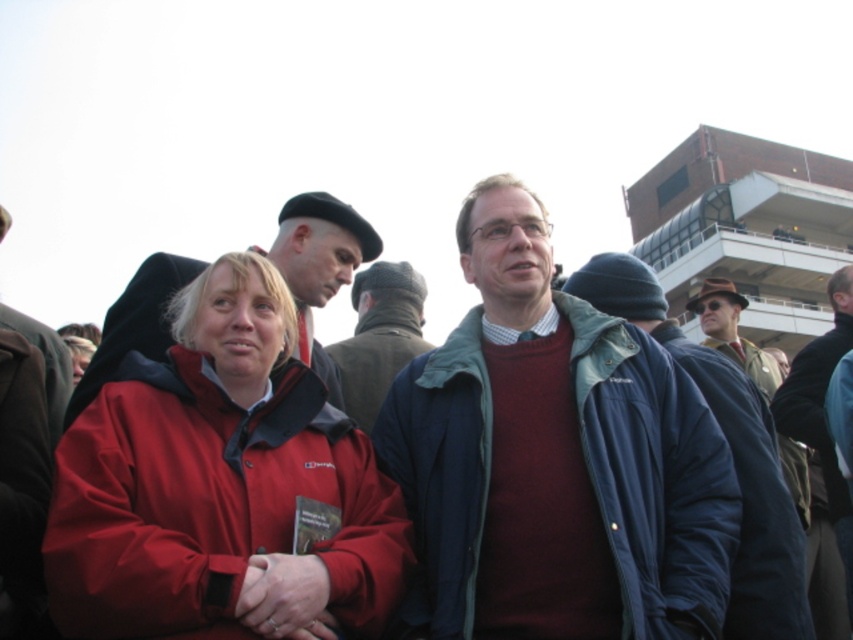
Is matte red jacket at center further to the viewer compared to matte black beret at upper left?

No, matte red jacket at center is in front of matte black beret at upper left.

Does point (331, 419) lie behind point (309, 285)?

No, (331, 419) is in front of (309, 285).

At what (x,y) coordinates should I click in order to perform the action: click on matte red jacket at center. Please return your answer as a coordinate pair (x, y). Looking at the image, I should click on (216, 480).

Can you confirm if blue fabric jacket at center is taller than blue denim jacket at center?

Correct, blue fabric jacket at center is much taller as blue denim jacket at center.

Who is shorter, blue fabric jacket at center or blue denim jacket at center?

Standing shorter between the two is blue denim jacket at center.

Which is behind, point (405, 372) or point (403, 352)?

Positioned behind is point (403, 352).

I want to click on blue fabric jacket at center, so click(654, 472).

Is blue fabric jacket at center closer to the viewer compared to maroon sweater at center?

Yes, blue fabric jacket at center is closer to the viewer.

Is point (669, 524) in front of point (798, 563)?

That is False.

Which is in front, point (666, 396) or point (749, 417)?

Point (666, 396) is in front.

Find the location of a particular element. This screenshot has height=640, width=853. blue fabric jacket at center is located at coordinates (654, 472).